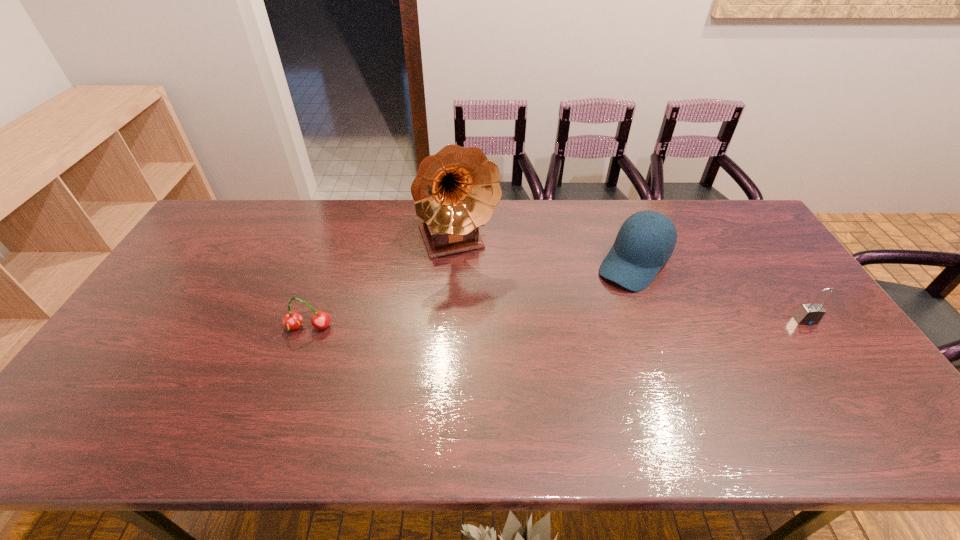
You are a GUI agent. You are given a task and a screenshot of the screen. Output one action in this format:
    pyautogui.click(x=<x>, y=<y>)
    Task: Click on the free spot on the desktop that is between the leftmost object and the rightmost object and is positioned on the front-facing side of the second tallest object
    Image resolution: width=960 pixels, height=540 pixels.
    Given the screenshot: What is the action you would take?
    pyautogui.click(x=583, y=323)

Locate an element on the screen. The width and height of the screenshot is (960, 540). vacant space on the desktop that is between the leftmost object and the rightmost object and is positioned on the horn of the tallest object is located at coordinates (493, 325).